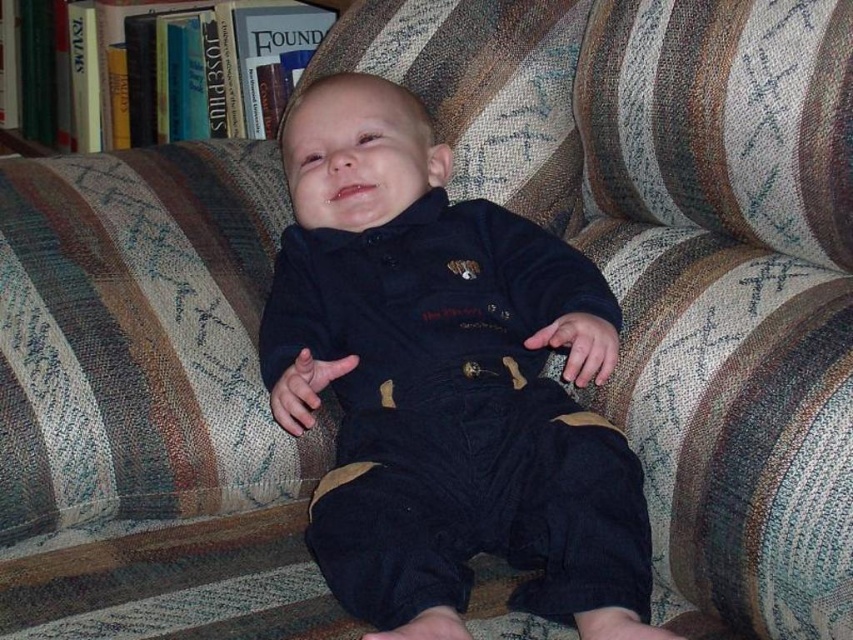
Based on the scene description, where is the velvet dark blue onesie at center located in terms of its 2D coordinates?

The velvet dark blue onesie at center is located at the 2D coordinates of point (445,384).

You are taking a photo of the baby and need to focus on two specific points in the image. The first point is at coordinate point(x=369, y=616) and the second is at point(x=200, y=19). Which point should you focus on to ensure the baby remains in sharp focus?

Answer: You should focus on point(x=369, y=616) because it is closer to the camera than point(x=200, y=19), ensuring the baby stays in focus.

Consider the image. You are a photographer trying to capture the baby in the image. The baby is wearing a dark blue onesie. You want to focus your camera on the exact point at coordinates point (445,384). Where should you aim your camera to ensure the focus is on the baby?

The point (445,384) is on the velvet dark blue onesie at center, so you should aim your camera at the center of the baby where the dark blue onesie is located to ensure proper focus.